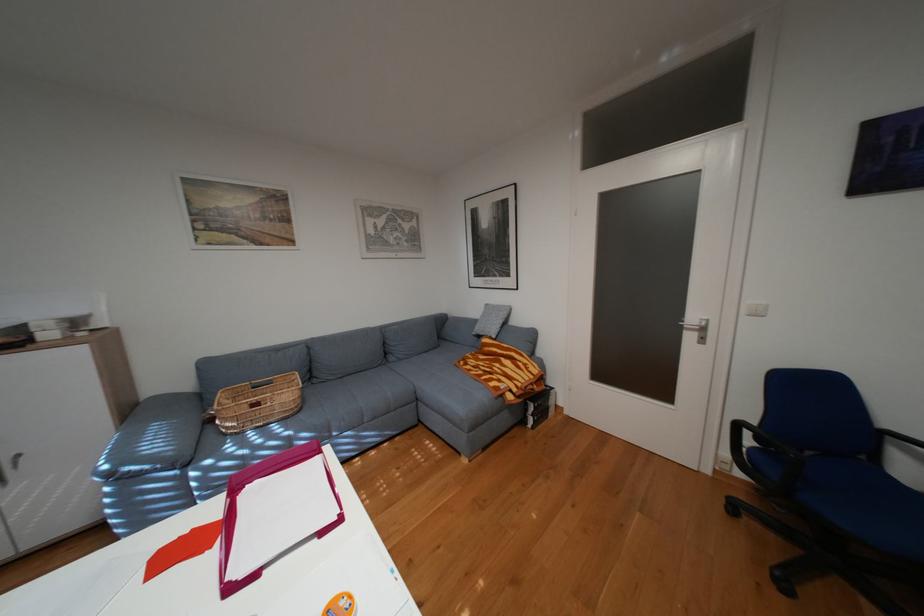
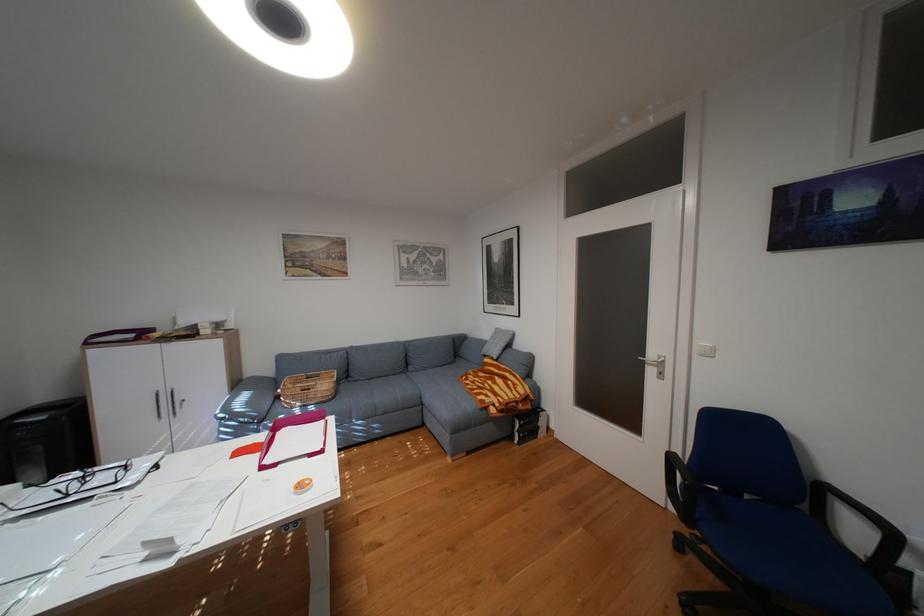
Locate, in the second image, the point that corresponds to point (539, 423) in the first image.

(526, 438)